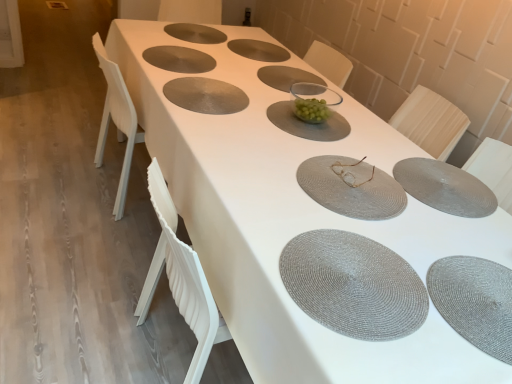
Where is `free region on the left part of clear glass bowl at center, which ranks as the 4th tableware in top-to-bottom order`? Image resolution: width=512 pixels, height=384 pixels. free region on the left part of clear glass bowl at center, which ranks as the 4th tableware in top-to-bottom order is located at coordinates (262, 109).